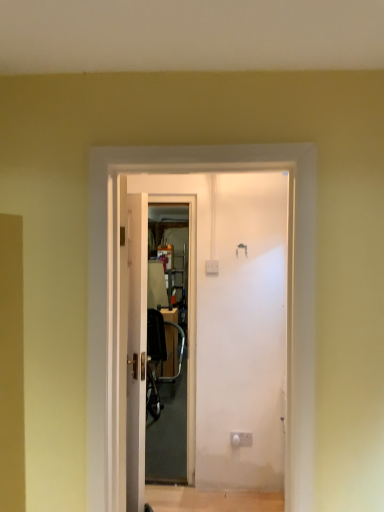
Question: Is transparent plastic screen door at center at the right side of white glossy door at center?

Choices:
 (A) yes
 (B) no

Answer: (A)

Question: Can white glossy door at center be found inside transparent plastic screen door at center?

Choices:
 (A) yes
 (B) no

Answer: (B)

Question: Does transparent plastic screen door at center have a greater height compared to white glossy door at center?

Choices:
 (A) yes
 (B) no

Answer: (A)

Question: Considering the relative positions of transparent plastic screen door at center and white glossy door at center in the image provided, is transparent plastic screen door at center to the left of white glossy door at center from the viewer's perspective?

Choices:
 (A) yes
 (B) no

Answer: (B)

Question: Does transparent plastic screen door at center have a lesser width compared to white glossy door at center?

Choices:
 (A) no
 (B) yes

Answer: (A)

Question: Considering the positions of point (142, 251) and point (183, 334), is point (142, 251) closer or farther from the camera than point (183, 334)?

Choices:
 (A) closer
 (B) farther

Answer: (A)

Question: From a real-world perspective, is white glossy door at center above or below metallic silver chair at center?

Choices:
 (A) below
 (B) above

Answer: (B)

Question: In terms of height, does white glossy door at center look taller or shorter compared to metallic silver chair at center?

Choices:
 (A) short
 (B) tall

Answer: (B)

Question: From the image's perspective, is white glossy door at center positioned above or below metallic silver chair at center?

Choices:
 (A) above
 (B) below

Answer: (A)

Question: In terms of width, does white glossy door at center look wider or thinner when compared to transparent plastic screen door at center?

Choices:
 (A) thin
 (B) wide

Answer: (A)

Question: From the image's perspective, is white glossy door at center above or below transparent plastic screen door at center?

Choices:
 (A) below
 (B) above

Answer: (A)

Question: Is white glossy door at center in front of or behind transparent plastic screen door at center in the image?

Choices:
 (A) behind
 (B) front

Answer: (B)

Question: Is point (142, 281) positioned closer to the camera than point (178, 293)?

Choices:
 (A) farther
 (B) closer

Answer: (B)

Question: From the image's perspective, relative to white glossy door at center, is metallic silver chair at center above or below?

Choices:
 (A) below
 (B) above

Answer: (A)

Question: Based on their sizes in the image, would you say metallic silver chair at center is bigger or smaller than white glossy door at center?

Choices:
 (A) small
 (B) big

Answer: (B)